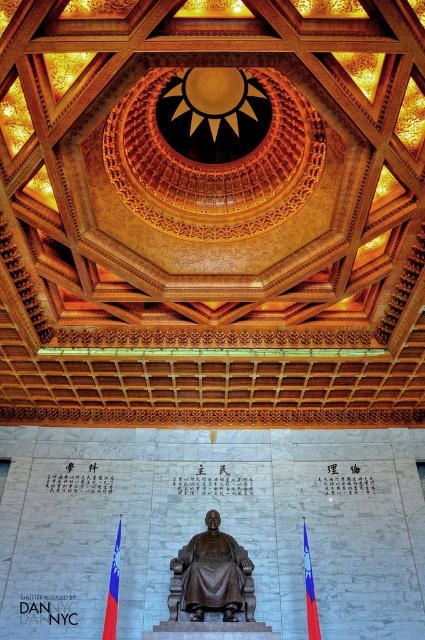
Who is positioned more to the left, bronze statue at center or blue-red striped flag at lower right?

From the viewer's perspective, bronze statue at center appears more on the left side.

Between bronze statue at center and blue-red striped flag at lower right, which one has more height?

With more height is bronze statue at center.

I want to click on bronze statue at center, so click(210, 573).

Between point (238, 595) and point (119, 538), which one is positioned behind?

The point (119, 538) is behind.

Which is above, bronze statue at center or red fabric flag at lower left?

bronze statue at center is above.

Between point (232, 566) and point (112, 611), which one is positioned behind?

The point (232, 566) is more distant.

In order to click on bronze statue at center in this screenshot , I will do coord(210,573).

Is red fabric flag at lower left closer to the viewer compared to blue-red striped flag at lower right?

Yes, it is.

Which is in front, point (116, 611) or point (312, 632)?

Point (312, 632)

This screenshot has height=640, width=425. What are the coordinates of `red fabric flag at lower left` in the screenshot? It's located at (113, 593).